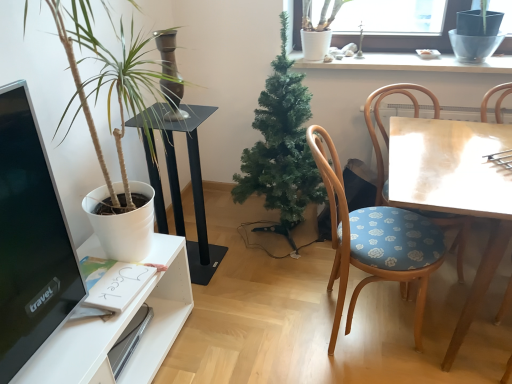
Where is `vacant space positioned to the left of wooden chair with blue floral cushion at right, arranged as the second chair when viewed from the right`? vacant space positioned to the left of wooden chair with blue floral cushion at right, arranged as the second chair when viewed from the right is located at coordinates (265, 322).